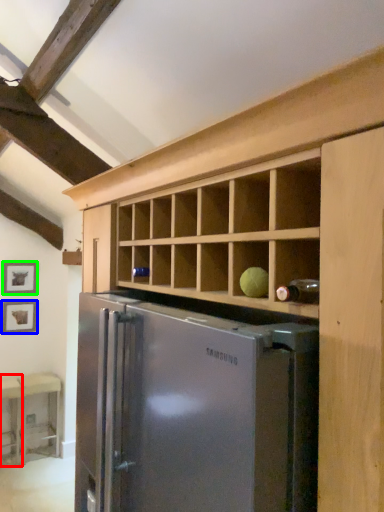
Question: Considering the real-world distances, which object is closest to table (highlighted by a red box)? picture frame (highlighted by a blue box) or picture frame (highlighted by a green box).

Choices:
 (A) picture frame
 (B) picture frame

Answer: (A)